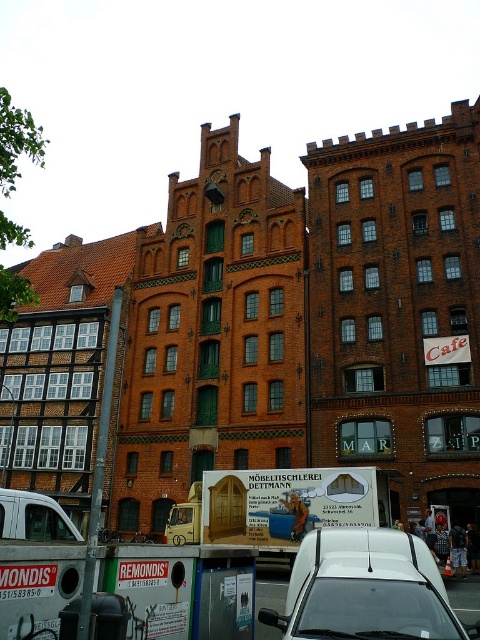
Question: Can you confirm if white matte van at center is positioned to the right of white matte van at lower left?

Choices:
 (A) yes
 (B) no

Answer: (A)

Question: Where is white matte van at center located in relation to white matte van at lower left in the image?

Choices:
 (A) above
 (B) below

Answer: (A)

Question: Which point is closer to the camera?

Choices:
 (A) (60, 529)
 (B) (315, 595)

Answer: (B)

Question: Is white matte van at center above white matte van at lower left?

Choices:
 (A) yes
 (B) no

Answer: (A)